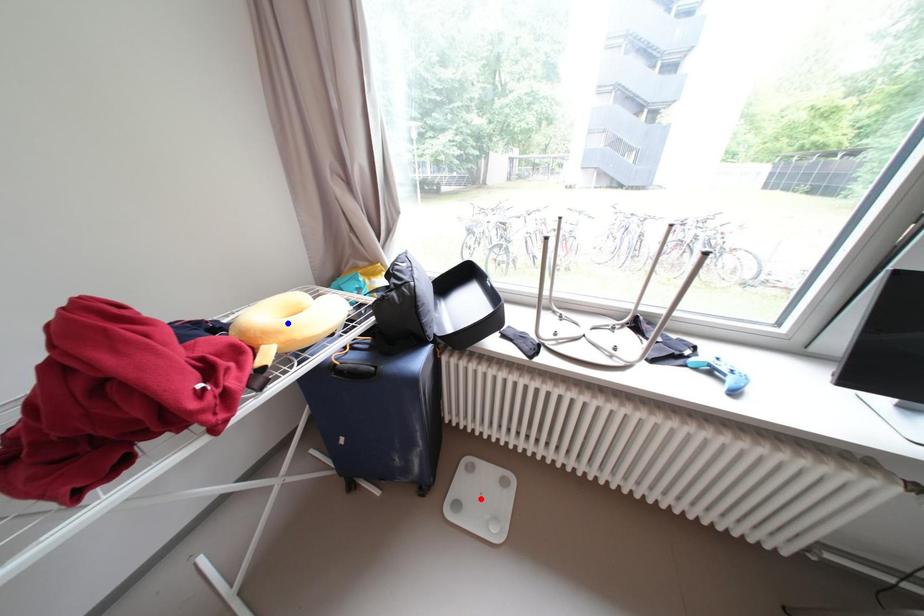
Question: Two points are marked on the image. Which point is closer to the camera?

Choices:
 (A) Blue point is closer.
 (B) Red point is closer.

Answer: (A)